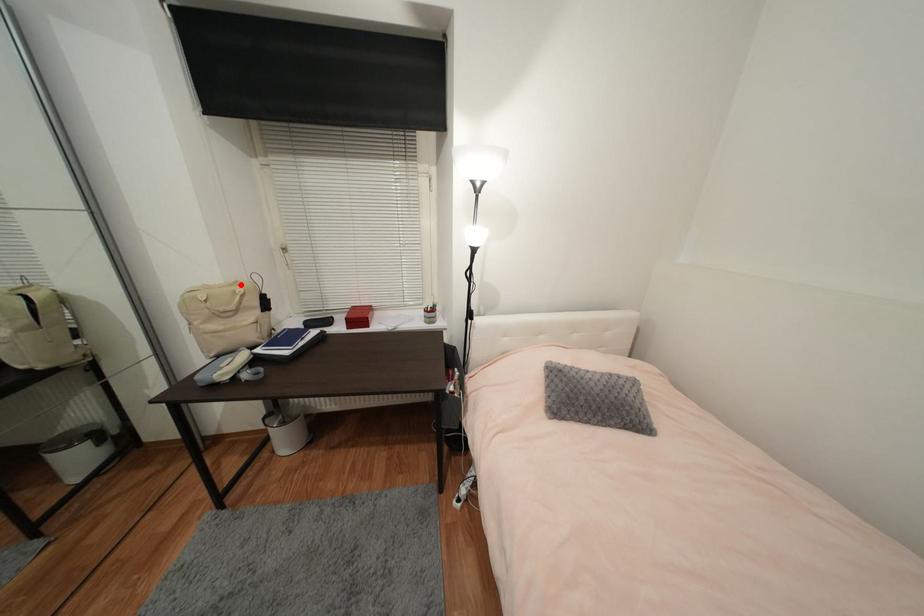
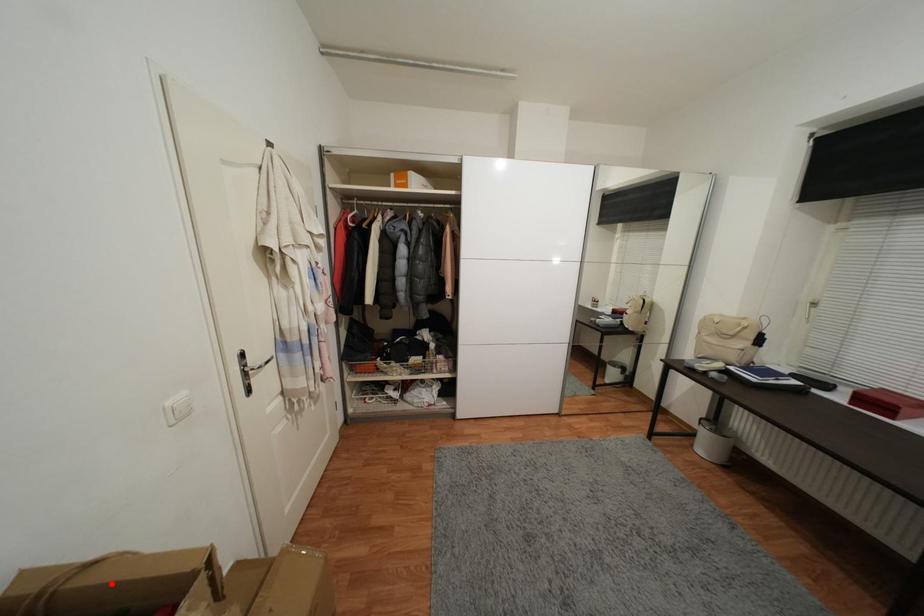
I am providing you with two images of the same scene from different viewpoints. A red point is marked on the first image and another point is marked on the second image. Is the red point in image1 aligned with the point shown in image2?

No